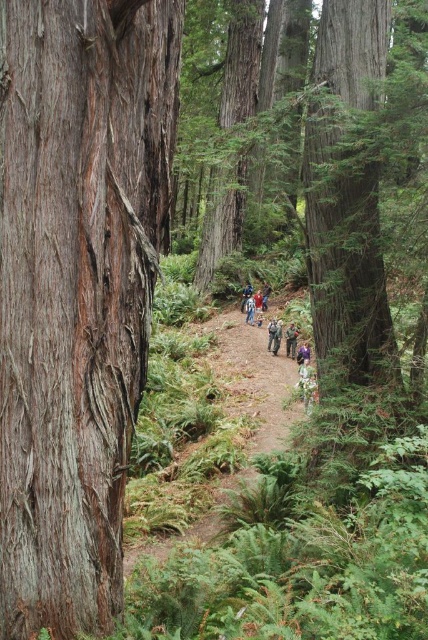
Question: Can you confirm if camouflage jacket at center is wider than blue jeans at center?

Choices:
 (A) yes
 (B) no

Answer: (A)

Question: Is brown dirt path at center to the left of blue jeans at center from the viewer's perspective?

Choices:
 (A) yes
 (B) no

Answer: (A)

Question: Which object is the closest to the blue jeans at center?

Choices:
 (A) brown dirt path at center
 (B) smooth brown bark at center
 (C) camouflage jacket at center

Answer: (C)

Question: Which of the following is the farthest from the observer?

Choices:
 (A) smooth brown bark at center
 (B) brown dirt path at center

Answer: (B)

Question: Which point is closer to the camera?

Choices:
 (A) (124, 449)
 (B) (279, 324)
 (C) (142, 502)
 (D) (293, 349)

Answer: (A)

Question: Can you confirm if smooth brown bark at center is bigger than green camouflage jacket at center?

Choices:
 (A) no
 (B) yes

Answer: (B)